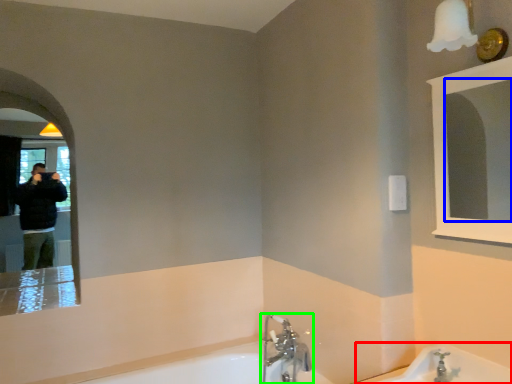
Question: Estimate the real-world distances between objects in this image. Which object is farther from bath (highlighted by a red box), mirror (highlighted by a blue box) or tap (highlighted by a green box)?

Choices:
 (A) mirror
 (B) tap

Answer: (A)